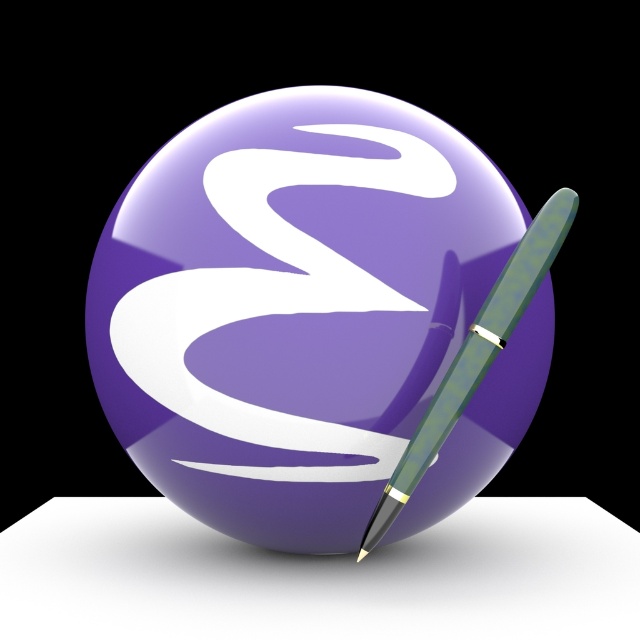
Which of these two, glossy purple sphere at center or translucent green fountain pen at right, stands shorter?

translucent green fountain pen at right is shorter.

Which is in front, point (145, 211) or point (563, 234)?

Point (563, 234) is in front.

Locate an element on the screen. This screenshot has height=640, width=640. glossy purple sphere at center is located at coordinates (292, 305).